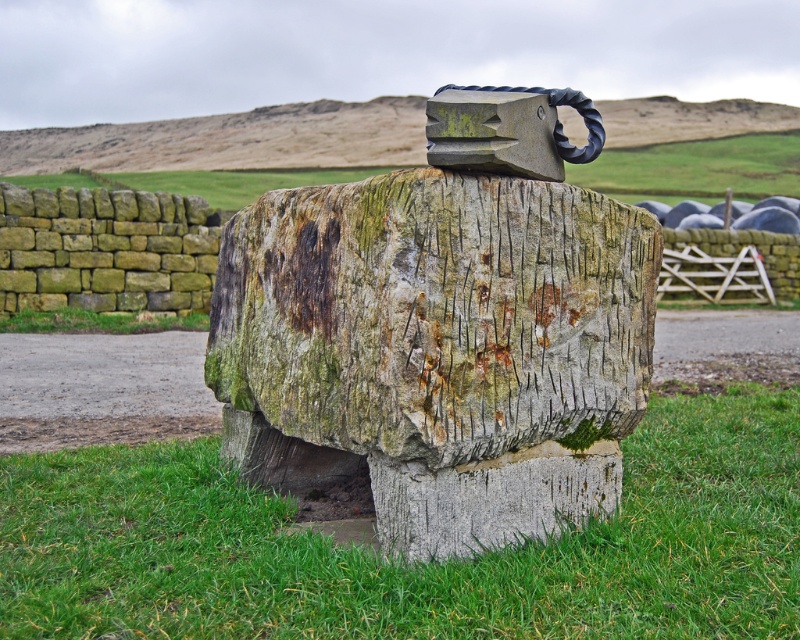
Is yellowish stone wall at left taller than green grass at center?

Yes.

Can you confirm if yellowish stone wall at left is smaller than green grass at center?

No.

Measure the distance between point (162, 273) and camera.

The distance of point (162, 273) from camera is 59.10 feet.

Image resolution: width=800 pixels, height=640 pixels. What are the coordinates of `yellowish stone wall at left` in the screenshot? It's located at (104, 250).

Measure the distance from green grass at lower center to green grass at center.

green grass at lower center is 18.14 meters away from green grass at center.

Which of these two, green grass at lower center or green grass at center, stands taller?

green grass at lower center

Does point (616, 525) come farther from viewer compared to point (230, 180)?

No, it is not.

Locate an element on the screen. green grass at lower center is located at coordinates (418, 563).

At what (x,y) coordinates should I click in order to perform the action: click on green grass at lower center. Please return your answer as a coordinate pair (x, y). The width and height of the screenshot is (800, 640). Looking at the image, I should click on (418, 563).

Measure the distance between point (x=588, y=596) and camera.

4.18 meters

Find the location of a particular element. green grass at lower center is located at coordinates (418, 563).